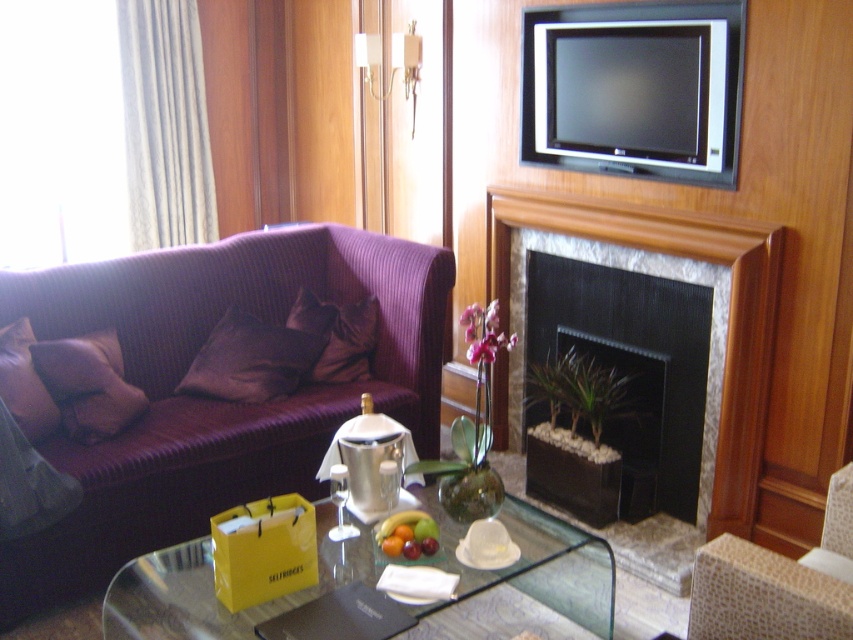
Who is positioned more to the left, black stone fireplace at center or transparent glass table at center?

transparent glass table at center is more to the left.

Which is in front, point (534, 268) or point (206, 548)?

Positioned in front is point (206, 548).

Which is in front, point (672, 358) or point (151, 596)?

Point (151, 596)

Find the location of `black stone fireplace at center`. black stone fireplace at center is located at coordinates (631, 368).

Between transparent glass table at center and black marble fireplace at center, which one has more height?

black marble fireplace at center

Is transparent glass table at center further to camera compared to black marble fireplace at center?

No.

The image size is (853, 640). Identify the location of transparent glass table at center. (527, 577).

Who is higher up, transparent glass table at center or leather at right?

leather at right is higher up.

The image size is (853, 640). What do you see at coordinates (527, 577) in the screenshot?
I see `transparent glass table at center` at bounding box center [527, 577].

The width and height of the screenshot is (853, 640). Identify the location of transparent glass table at center. (527, 577).